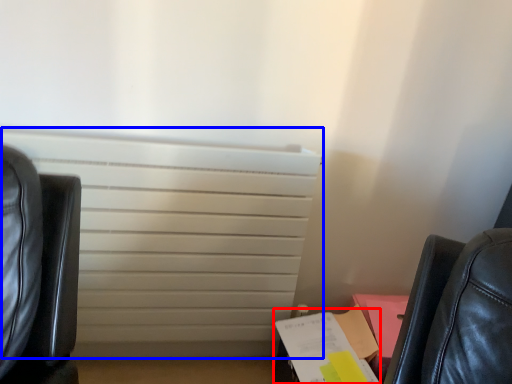
Question: Which of the following is the farthest to the observer, paperback book (highlighted by a red box) or radiator (highlighted by a blue box)?

Choices:
 (A) paperback book
 (B) radiator

Answer: (A)